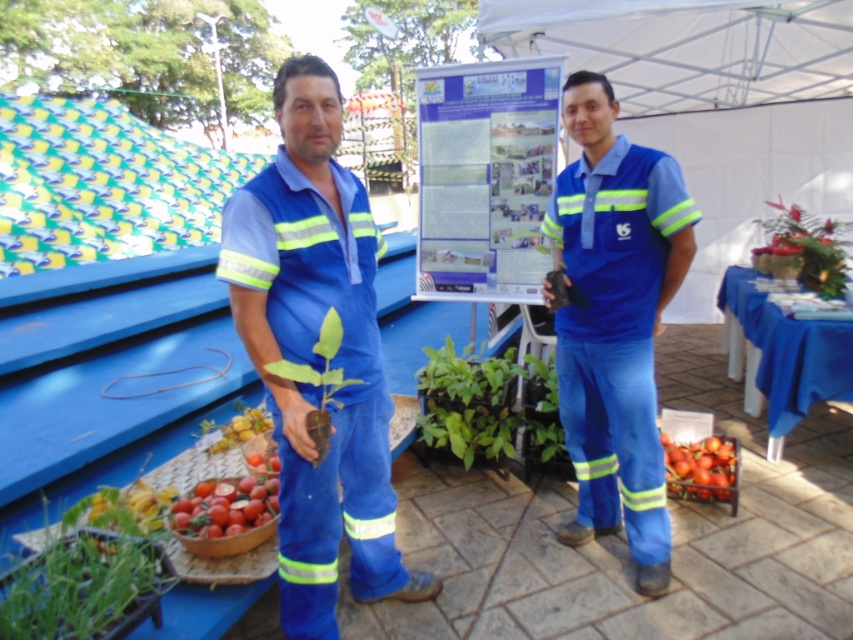
You are at an outdoor event and see a point marked at coordinates (485,404). Based on the scene description, which object from the list is this point located on?

The point at (485,404) is located on the green leafy plant at center.

You are a visitor at an agricultural event and want to take a photo of both the green leafy plant at center and the smooth glossy tomatoes at center. Which object should you focus on first if you want to capture them in the correct left to right order?

You should focus on the green leafy plant at center first since it is positioned to the left of the smooth glossy tomatoes at center, ensuring the left to right order is maintained in your photo.

You are a visitor at this event and want to place a new item between the green leafy plant at center and the smooth glossy tomatoes at center. Is there enough space to fit an item that is 70 centimeters long?

The green leafy plant at center is 74.36 centimeters away from the smooth glossy tomatoes at center. Since the distance between them is greater than 70 centimeters, there is enough space to fit the item.